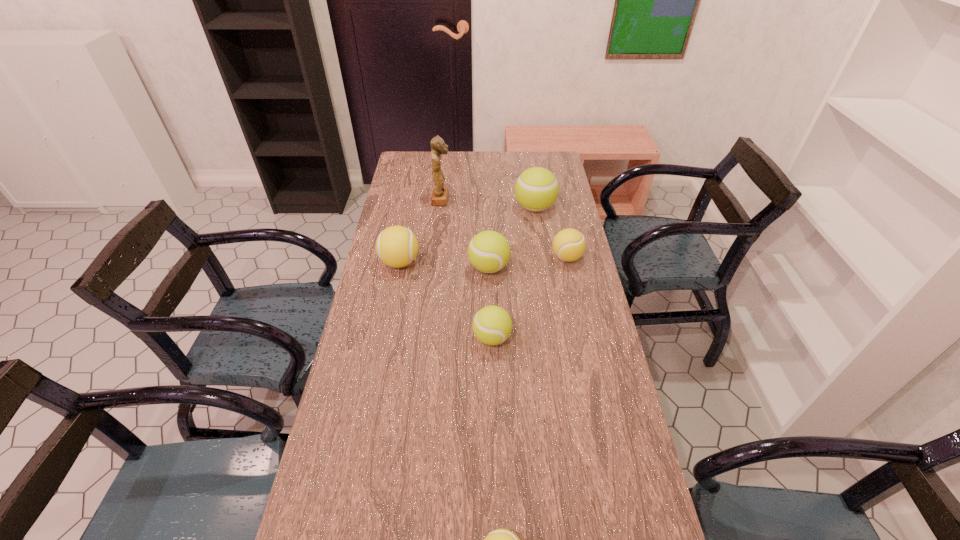
Identify which tennis ball is located as the second nearest to the tallest object. Please provide its 2D coordinates. Your answer should be formatted as a tuple, i.e. [(x, y)], where the tuple contains the x and y coordinates of a point satisfying the conditions above.

[(396, 246)]

What are the coordinates of `tennis ball that is the third closest one to the second object from left to right` in the screenshot? It's located at (488, 251).

Choose which green tennis ball is the third nearest neighbor to the tallest object. Please provide its 2D coordinates. Your answer should be formatted as a tuple, i.e. [(x, y)], where the tuple contains the x and y coordinates of a point satisfying the conditions above.

[(492, 325)]

Find the location of `green tennis ball that can be found as the third closest to the leftmost object`. green tennis ball that can be found as the third closest to the leftmost object is located at coordinates (536, 189).

I want to click on yellow tennis ball that is the third closest to the second farthest green tennis ball, so click(x=500, y=539).

Locate an element on the screen. yellow tennis ball that is the second nearest to the shortest object is located at coordinates (569, 244).

The width and height of the screenshot is (960, 540). I want to click on vacant space that satisfies the following two spatial constraints: 1. on the front-facing side of the second biggest yellow tennis ball; 2. on the right side of the figurine, so click(x=435, y=258).

What are the coordinates of `vacant area in the image that satisfies the following two spatial constraints: 1. on the back side of the smallest green tennis ball; 2. on the front-facing side of the figurine` in the screenshot? It's located at (489, 200).

Image resolution: width=960 pixels, height=540 pixels. What are the coordinates of `blank area in the image that satisfies the following two spatial constraints: 1. on the front-facing side of the second object from left to right; 2. on the right side of the fifth farthest tennis ball` in the screenshot? It's located at (x=426, y=338).

The width and height of the screenshot is (960, 540). What are the coordinates of `free region that satisfies the following two spatial constraints: 1. on the front-facing side of the sixth object from right to left; 2. on the left side of the second nearest green tennis ball` in the screenshot? It's located at (434, 268).